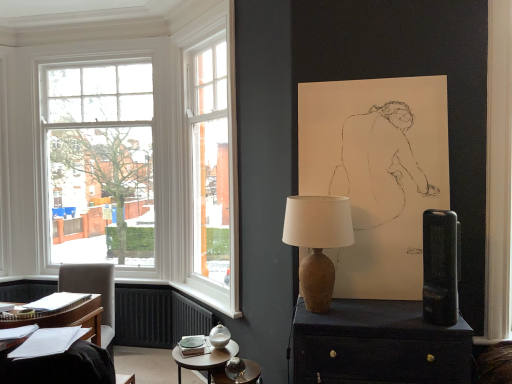
Where is `vacant area situated below brown ceramic lamp at center (from a real-world perspective)`? The width and height of the screenshot is (512, 384). vacant area situated below brown ceramic lamp at center (from a real-world perspective) is located at coordinates (325, 318).